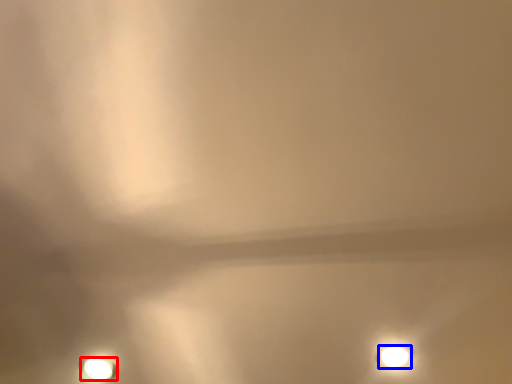
Question: Among these objects, which one is nearest to the camera, lamp (highlighted by a red box) or lamp (highlighted by a blue box)?

Choices:
 (A) lamp
 (B) lamp

Answer: (B)